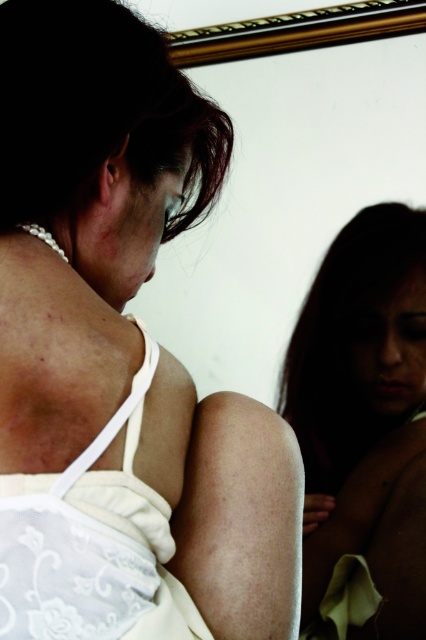
Based on the photo, can you confirm if white lace wedding dress at upper left is bigger than dark brown hair at lower right?

Incorrect, white lace wedding dress at upper left is not larger than dark brown hair at lower right.

Image resolution: width=426 pixels, height=640 pixels. Describe the element at coordinates (92, 545) in the screenshot. I see `white lace wedding dress at upper left` at that location.

Describe the element at coordinates (92, 545) in the screenshot. I see `white lace wedding dress at upper left` at that location.

At what (x,y) coordinates should I click in order to perform the action: click on white lace wedding dress at upper left. Please return your answer as a coordinate pair (x, y). This screenshot has height=640, width=426. Looking at the image, I should click on (92, 545).

Between dark brown hair at upper left and dark brown hair at lower right, which one is positioned higher?

dark brown hair at upper left is above.

This screenshot has height=640, width=426. What do you see at coordinates (97, 109) in the screenshot?
I see `dark brown hair at upper left` at bounding box center [97, 109].

Which is in front, point (186, 129) or point (363, 420)?

Point (186, 129)

This screenshot has width=426, height=640. What are the coordinates of `dark brown hair at upper left` in the screenshot? It's located at (97, 109).

Which is more to the right, white lace dress at center or dark brown hair at upper left?

From the viewer's perspective, white lace dress at center appears more on the right side.

Does white lace dress at center have a lesser width compared to dark brown hair at upper left?

No, white lace dress at center is not thinner than dark brown hair at upper left.

Is point (29, 221) less distant than point (147, 38)?

That is True.

Find the location of a particular element. The width and height of the screenshot is (426, 640). white lace dress at center is located at coordinates coord(120,356).